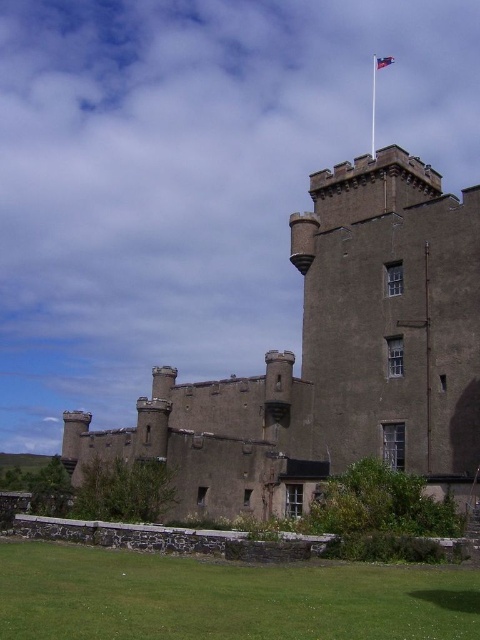
Question: Is brown stone castle at center behind blue fabric flag at upper center?

Choices:
 (A) yes
 (B) no

Answer: (B)

Question: Can you confirm if brown stone castle at center is positioned above blue fabric flag at upper center?

Choices:
 (A) yes
 (B) no

Answer: (B)

Question: Which of the following is the farthest from the observer?

Choices:
 (A) pos(367,349)
 (B) pos(392,58)

Answer: (B)

Question: Can you confirm if brown stone castle at center is positioned below blue fabric flag at upper center?

Choices:
 (A) no
 (B) yes

Answer: (B)